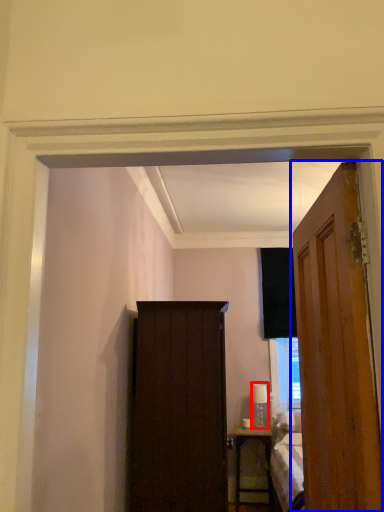
Question: Which point is further to the camera, lamp (highlighted by a red box) or door (highlighted by a blue box)?

Choices:
 (A) lamp
 (B) door

Answer: (A)